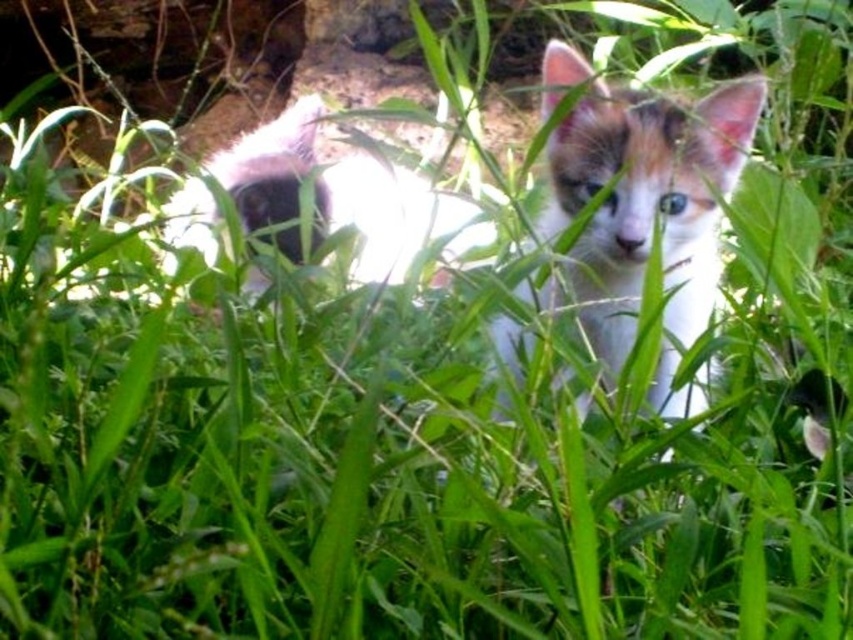
Question: Does calico fur kitten at center have a larger size compared to fluffy white cat at center?

Choices:
 (A) no
 (B) yes

Answer: (A)

Question: Which point appears farthest from the camera in this image?

Choices:
 (A) (297, 156)
 (B) (635, 230)

Answer: (A)

Question: Does calico fur kitten at center have a greater width compared to fluffy white cat at center?

Choices:
 (A) no
 (B) yes

Answer: (A)

Question: Which point is farther from the camera taking this photo?

Choices:
 (A) (683, 164)
 (B) (248, 140)

Answer: (B)

Question: Is calico fur kitten at center wider than fluffy white cat at center?

Choices:
 (A) no
 (B) yes

Answer: (A)